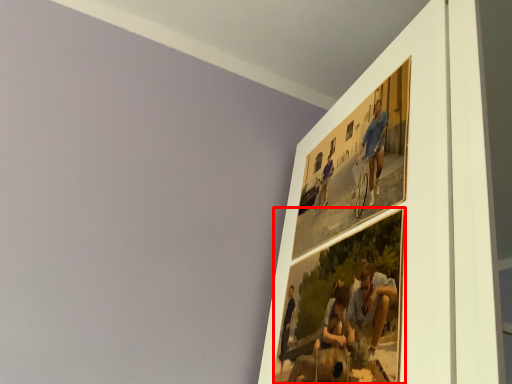
Question: From the image's perspective, what is the correct spatial positioning of picture frame (annotated by the red box) in reference to picture frame?

Choices:
 (A) above
 (B) below

Answer: (B)